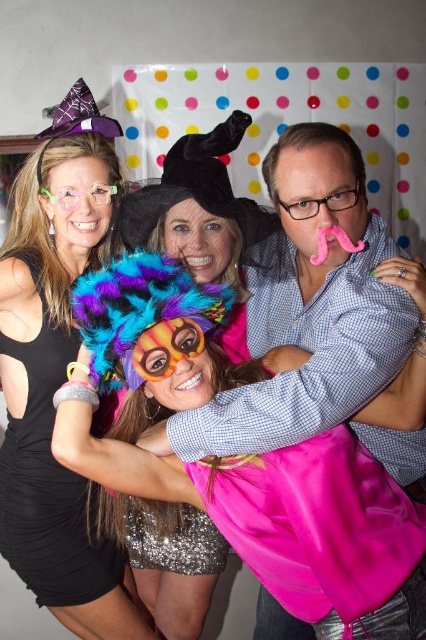
Question: Which point appears closest to the camera in this image?

Choices:
 (A) tap(36, 588)
 (B) tap(195, 275)

Answer: (B)

Question: Can you confirm if fuzzy multicolored wig at center is wider than black satin dress at left?

Choices:
 (A) no
 (B) yes

Answer: (B)

Question: Considering the relative positions of fuzzy multicolored wig at center and black satin dress at left in the image provided, where is fuzzy multicolored wig at center located with respect to black satin dress at left?

Choices:
 (A) above
 (B) below

Answer: (A)

Question: Can you confirm if fuzzy multicolored wig at center is bigger than black satin dress at left?

Choices:
 (A) yes
 (B) no

Answer: (B)